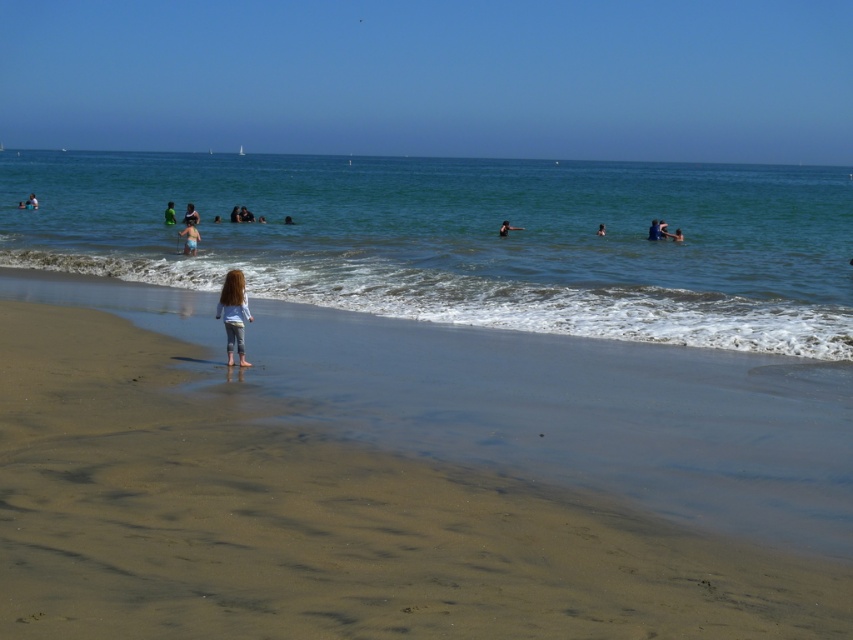
Question: Is light brown hair at center smaller than white cotton shirt at center?

Choices:
 (A) yes
 (B) no

Answer: (A)

Question: Can you confirm if light blue fabric swimsuit at center is positioned to the right of light brown skin at center?

Choices:
 (A) no
 (B) yes

Answer: (B)

Question: Which object is closer to the camera taking this photo?

Choices:
 (A) light brown skin at center
 (B) light blue fabric swimmer at center
 (C) white cotton shirt at center
 (D) sandy beach at lower left

Answer: (D)

Question: Does light brown hair at center have a larger size compared to white cotton shirt at center?

Choices:
 (A) no
 (B) yes

Answer: (A)

Question: Considering the real-world distances, which object is closest to the sandy beach at lower left?

Choices:
 (A) blue fabric swimmer at upper right
 (B) light blue fabric swimsuit at center
 (C) clear blue water at center
 (D) light brown hair at center

Answer: (D)

Question: Which point is farther to the camera?

Choices:
 (A) (291, 220)
 (B) (218, 317)
 (C) (477, 264)

Answer: (A)